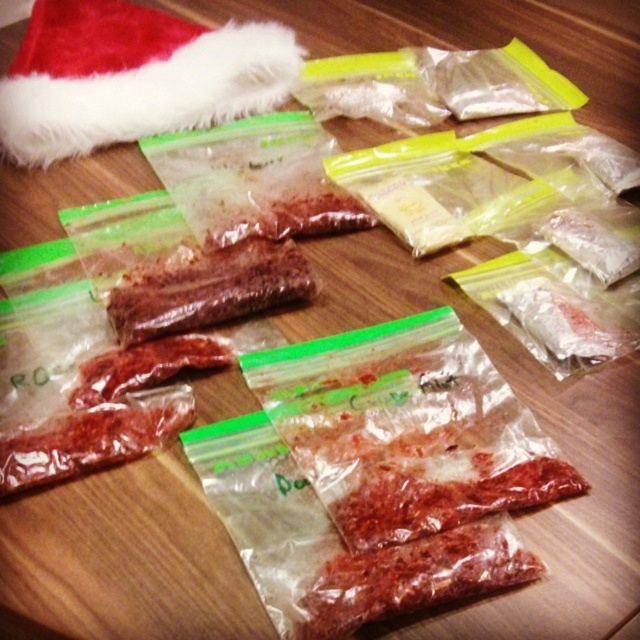
Is red matte meat at center positioned at the back of translucent plastic bag at center?

No, it is not.

Which is in front, point (486, 592) or point (579, 493)?

Positioned in front is point (486, 592).

Is point (506, 566) positioned behind point (566, 476)?

That is False.

The image size is (640, 640). I want to click on red matte meat at center, so click(x=413, y=577).

Consider the image. Can you confirm if translucent plastic bag at center is taller than red matte dried meat at left?

No, translucent plastic bag at center is not taller than red matte dried meat at left.

Is translucent plastic bag at center shorter than red matte dried meat at left?

Indeed, translucent plastic bag at center has a lesser height compared to red matte dried meat at left.

At what (x,y) coordinates should I click in order to perform the action: click on translucent plastic bag at center. Please return your answer as a coordinate pair (x, y). The width and height of the screenshot is (640, 640). Looking at the image, I should click on (445, 496).

Where is `translucent plastic bag at center`? translucent plastic bag at center is located at coordinates (445, 496).

Is red matte dried meat at center thinner than red matte dried meat at lower left?

No.

Which is more to the left, red matte dried meat at center or red matte dried meat at lower left?

Positioned to the left is red matte dried meat at lower left.

What do you see at coordinates (205, 289) in the screenshot? I see `red matte dried meat at center` at bounding box center [205, 289].

Image resolution: width=640 pixels, height=640 pixels. Identify the location of red matte dried meat at center. (205, 289).